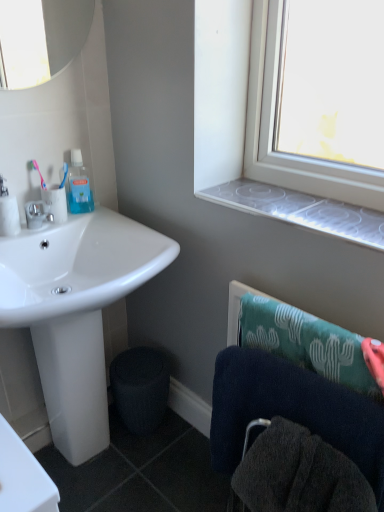
Question: Considering the relative sizes of pink plastic toothbrush at upper left and transparent plastic mouthwash at upper left in the image provided, is pink plastic toothbrush at upper left smaller than transparent plastic mouthwash at upper left?

Choices:
 (A) yes
 (B) no

Answer: (A)

Question: Is pink plastic toothbrush at upper left beside transparent plastic mouthwash at upper left?

Choices:
 (A) no
 (B) yes

Answer: (A)

Question: Does pink plastic toothbrush at upper left have a greater height compared to transparent plastic mouthwash at upper left?

Choices:
 (A) no
 (B) yes

Answer: (A)

Question: From the image's perspective, is pink plastic toothbrush at upper left beneath transparent plastic mouthwash at upper left?

Choices:
 (A) yes
 (B) no

Answer: (A)

Question: From a real-world perspective, is pink plastic toothbrush at upper left physically above transparent plastic mouthwash at upper left?

Choices:
 (A) yes
 (B) no

Answer: (A)

Question: From a real-world perspective, is dark blue towel at lower right physically located above or below white matte toilet paper at left, the 2th toilet paper from the right?

Choices:
 (A) above
 (B) below

Answer: (B)

Question: Is dark blue towel at lower right bigger or smaller than white matte toilet paper at left, the 2th toilet paper from the right?

Choices:
 (A) big
 (B) small

Answer: (A)

Question: Do you think dark blue towel at lower right is within white matte toilet paper at left, acting as the 1th toilet paper starting from the left, or outside of it?

Choices:
 (A) inside
 (B) outside

Answer: (B)

Question: Based on their positions, is dark blue towel at lower right located to the left or right of white matte toilet paper at left, the 2th toilet paper from the right?

Choices:
 (A) right
 (B) left

Answer: (A)

Question: Is point (51, 209) closer or farther from the camera than point (271, 202)?

Choices:
 (A) closer
 (B) farther

Answer: (B)

Question: Is white glossy toilet paper at left, the first toilet paper when ordered from right to left, taller or shorter than transparent plastic window sill at upper right?

Choices:
 (A) short
 (B) tall

Answer: (B)

Question: Is white glossy toilet paper at left, the second toilet paper positioned from the left, bigger or smaller than transparent plastic window sill at upper right?

Choices:
 (A) big
 (B) small

Answer: (B)

Question: Considering their positions, is white glossy toilet paper at left, the first toilet paper when ordered from right to left, located in front of or behind transparent plastic window sill at upper right?

Choices:
 (A) behind
 (B) front

Answer: (A)

Question: Is white glossy sink at lower left to the left or to the right of white matte toilet paper at left, acting as the 1th toilet paper starting from the left, in the image?

Choices:
 (A) right
 (B) left

Answer: (A)

Question: From a real-world perspective, is white glossy sink at lower left positioned above or below white matte toilet paper at left, the 2th toilet paper from the right?

Choices:
 (A) below
 (B) above

Answer: (A)